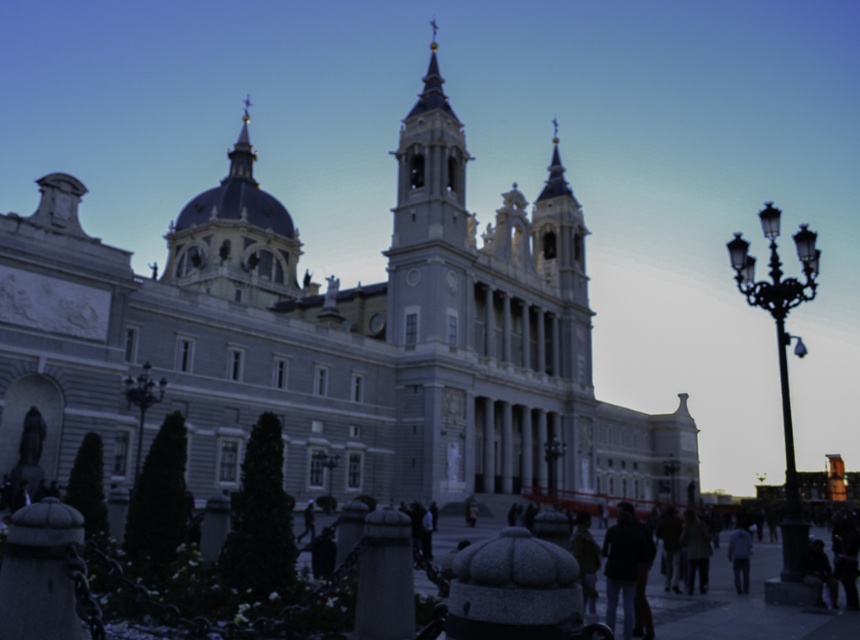
Who is lower down, smooth stone tower at center or light blue fabric jacket at lower right?

light blue fabric jacket at lower right is lower down.

This screenshot has width=860, height=640. I want to click on smooth stone tower at center, so click(x=430, y=168).

The image size is (860, 640). Find the location of `smooth stone tower at center`. smooth stone tower at center is located at coordinates (430, 168).

Measure the distance between point (517,372) and camera.

Point (517,372) and camera are 93.88 meters apart from each other.

This screenshot has height=640, width=860. What do you see at coordinates (335, 340) in the screenshot?
I see `gray stone church at center` at bounding box center [335, 340].

Image resolution: width=860 pixels, height=640 pixels. What are the coordinates of `gray stone church at center` in the screenshot? It's located at (335, 340).

In the scene shown: Between gold domed dome at upper center and smooth stone tower at center, which one appears on the left side from the viewer's perspective?

gold domed dome at upper center

Does gold domed dome at upper center have a greater width compared to smooth stone tower at center?

Correct, the width of gold domed dome at upper center exceeds that of smooth stone tower at center.

The image size is (860, 640). Describe the element at coordinates (235, 237) in the screenshot. I see `gold domed dome at upper center` at that location.

Where is `gold domed dome at upper center`? gold domed dome at upper center is located at coordinates (235, 237).